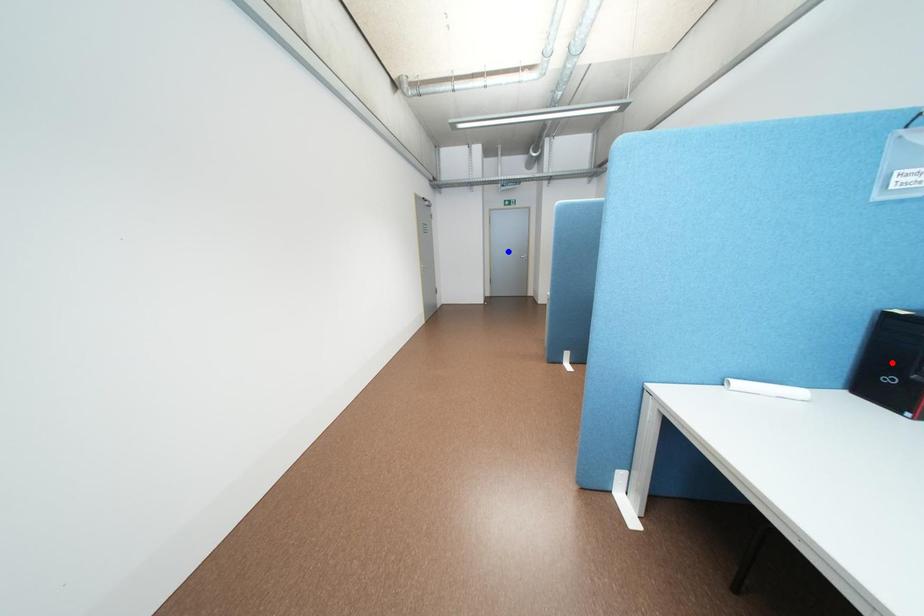
Question: Two points are marked on the image. Which point is closer to the camera?

Choices:
 (A) Blue point is closer.
 (B) Red point is closer.

Answer: (B)